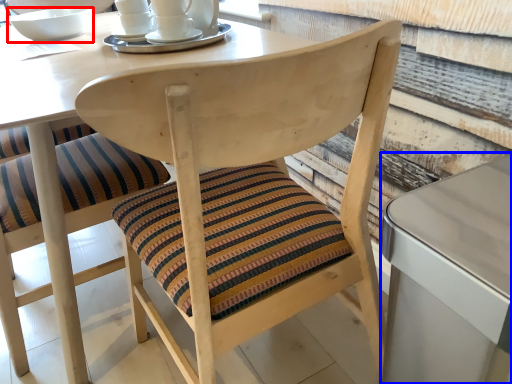
Question: Among these objects, which one is nearest to the camera, bowl (highlighted by a red box) or table (highlighted by a blue box)?

Choices:
 (A) bowl
 (B) table

Answer: (B)